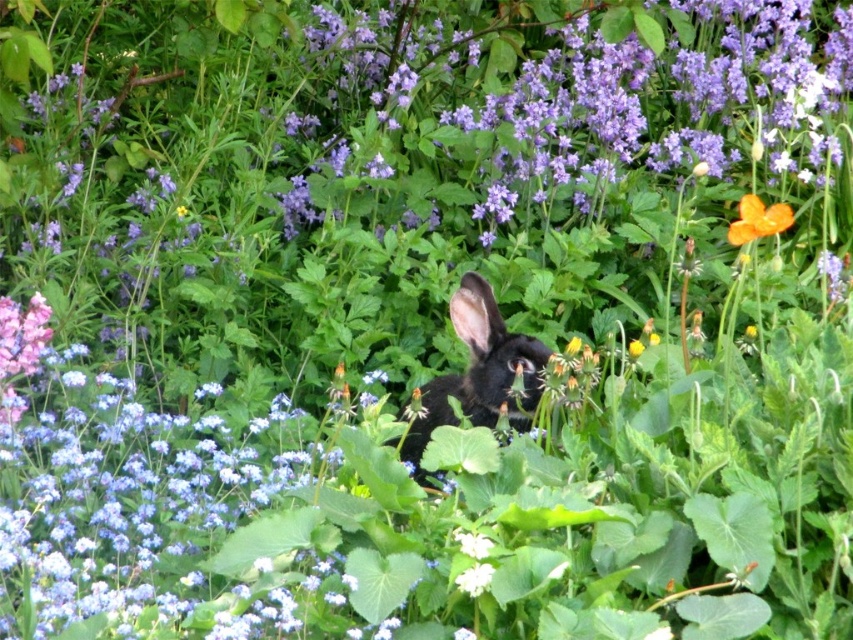
Can you confirm if black furry rabbit at center is taller than orange matte flower at upper right?

Yes.

Does black furry rabbit at center have a smaller size compared to orange matte flower at upper right?

Incorrect, black furry rabbit at center is not smaller in size than orange matte flower at upper right.

Is point (537, 358) more distant than point (764, 216)?

No, (537, 358) is closer to viewer.

The height and width of the screenshot is (640, 853). Find the location of `black furry rabbit at center`. black furry rabbit at center is located at coordinates (479, 371).